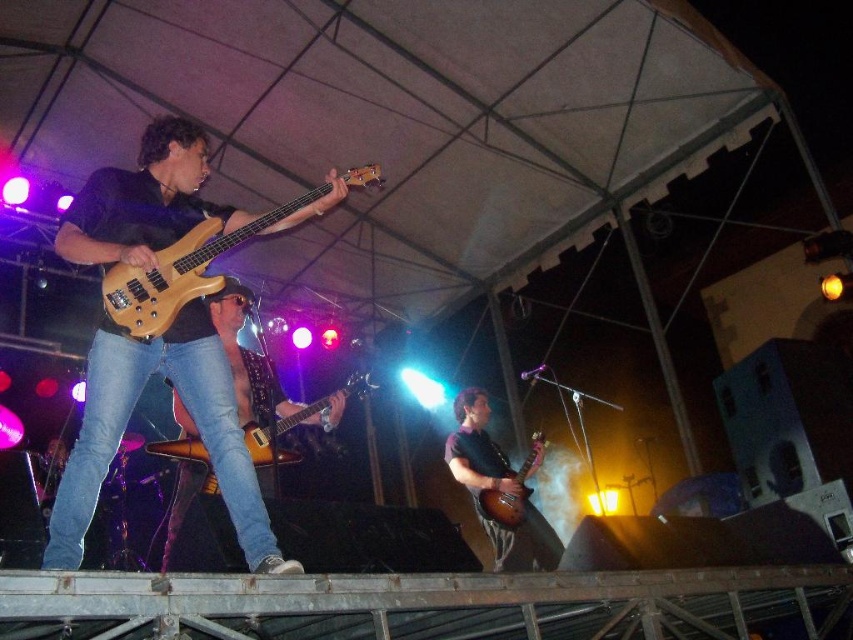
Between point (285, 212) and point (207, 460), which one is positioned in front?

Positioned in front is point (285, 212).

Can you confirm if glossy wood guitar at upper left is taller than glossy wood guitar at center?

Yes, glossy wood guitar at upper left is taller than glossy wood guitar at center.

Between point (317, 192) and point (192, 449), which one is positioned in front?

Point (317, 192)

Where is `glossy wood guitar at upper left`? glossy wood guitar at upper left is located at coordinates (183, 272).

Between point (202, 429) and point (164, 301), which one is positioned behind?

Point (164, 301)

Between matte wood bass guitar at left and glossy wood guitar at upper left, which one is positioned higher?

glossy wood guitar at upper left

Is point (56, 243) behind point (154, 333)?

That is True.

You are a GUI agent. You are given a task and a screenshot of the screen. Output one action in this format:
    pyautogui.click(x=<x>, y=<y>)
    Task: Click on the matte wood bass guitar at left
    This screenshot has height=640, width=853.
    Given the screenshot: What is the action you would take?
    pyautogui.click(x=189, y=413)

Who is taller, matte wood bass guitar at left or glossy wood guitar at center?

Standing taller between the two is matte wood bass guitar at left.

From the picture: How far apart are matte wood bass guitar at left and glossy wood guitar at center?

matte wood bass guitar at left is 3.94 feet away from glossy wood guitar at center.

Is point (195, 310) in front of point (274, 461)?

That is True.

Where is `matte wood bass guitar at left`? matte wood bass guitar at left is located at coordinates point(189,413).